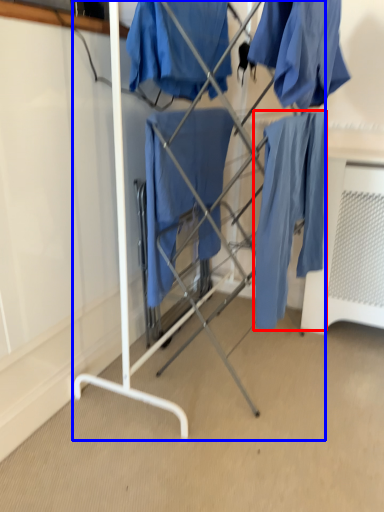
Question: Which of the following is the farthest to the observer, robe (highlighted by a red box) or furniture (highlighted by a blue box)?

Choices:
 (A) robe
 (B) furniture

Answer: (A)